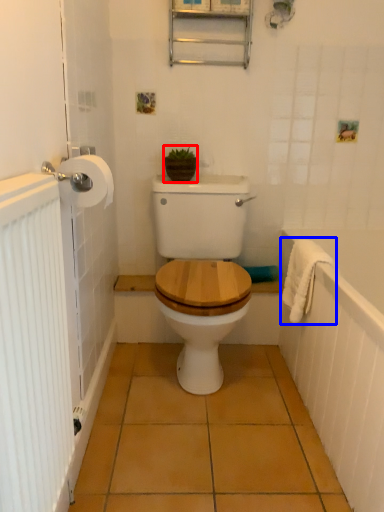
Question: Which object is closer to the camera taking this photo, plant (highlighted by a red box) or bath towel (highlighted by a blue box)?

Choices:
 (A) plant
 (B) bath towel

Answer: (B)